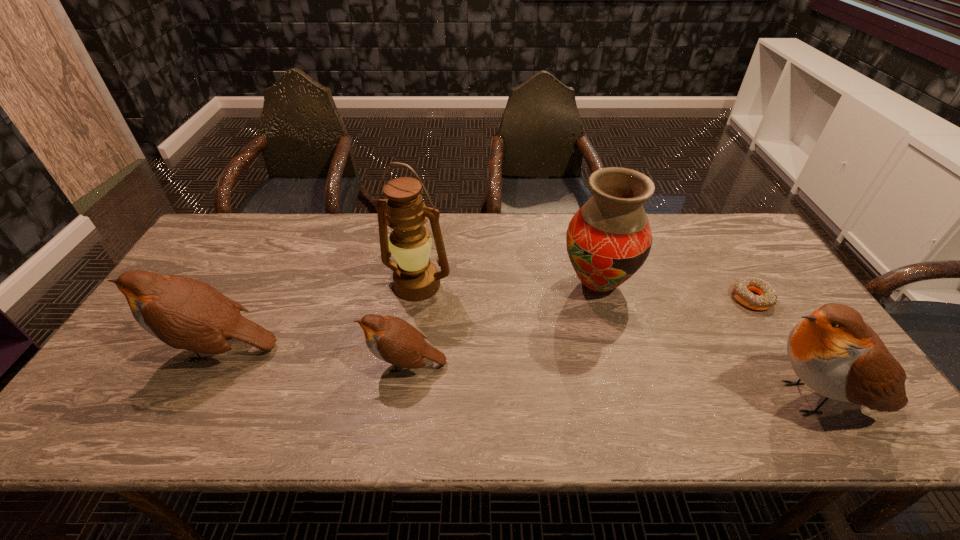
At what (x,y) coordinates should I click in order to perform the action: click on bird at the right edge. Please return your answer as a coordinate pair (x, y). The width and height of the screenshot is (960, 540). Looking at the image, I should click on (833, 351).

Where is `doughnut positioned at the right edge`? The height and width of the screenshot is (540, 960). doughnut positioned at the right edge is located at coordinates (741, 290).

Find the location of a particular element. object that is at the near left corner is located at coordinates (184, 313).

This screenshot has height=540, width=960. What are the coordinates of `object present at the near right corner` in the screenshot? It's located at (833, 351).

The width and height of the screenshot is (960, 540). I want to click on vacant area at the far edge of the desktop, so click(x=695, y=229).

The width and height of the screenshot is (960, 540). In order to click on free space at the near edge of the desktop in this screenshot , I will do `click(284, 373)`.

This screenshot has height=540, width=960. In the image, there is a desktop. What are the coordinates of `vacant region at the right edge` in the screenshot? It's located at (766, 343).

What are the coordinates of `free point at the far right corner` in the screenshot? It's located at (747, 253).

Image resolution: width=960 pixels, height=540 pixels. What are the coordinates of `vacant space that is in between the vase and the second shortest object` in the screenshot? It's located at (501, 324).

The height and width of the screenshot is (540, 960). Identify the location of vacant point located between the doughnut and the rightmost bird. (785, 348).